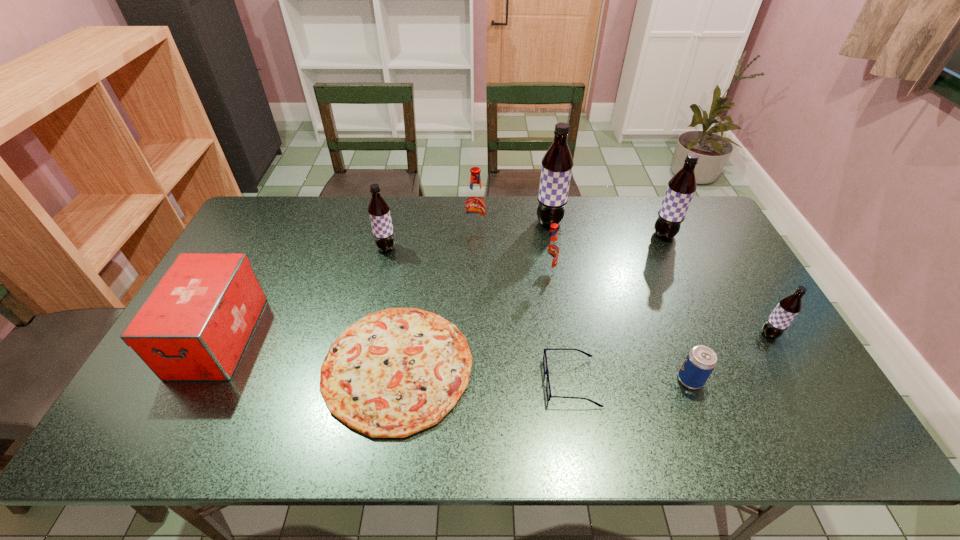
Where is `brown root beer that is the closest to the pizza`? This screenshot has height=540, width=960. brown root beer that is the closest to the pizza is located at coordinates (379, 211).

Where is `brown root beer that is the fourth closest to the second shortest object`? Image resolution: width=960 pixels, height=540 pixels. brown root beer that is the fourth closest to the second shortest object is located at coordinates (379, 211).

The height and width of the screenshot is (540, 960). What are the coordinates of `blank space that satisfies the following two spatial constraints: 1. on the back side of the biggest brown root beer; 2. on the left side of the pizza` in the screenshot? It's located at (420, 222).

This screenshot has width=960, height=540. I want to click on vacant space that satisfies the following two spatial constraints: 1. on the front side of the rightmost brown root beer; 2. on the left side of the leftmost root beer, so click(x=367, y=334).

Where is `free space that satisfies the following two spatial constraints: 1. on the back side of the leftmost root beer; 2. on the left side of the fifth shortest root beer`? The image size is (960, 540). free space that satisfies the following two spatial constraints: 1. on the back side of the leftmost root beer; 2. on the left side of the fifth shortest root beer is located at coordinates (390, 235).